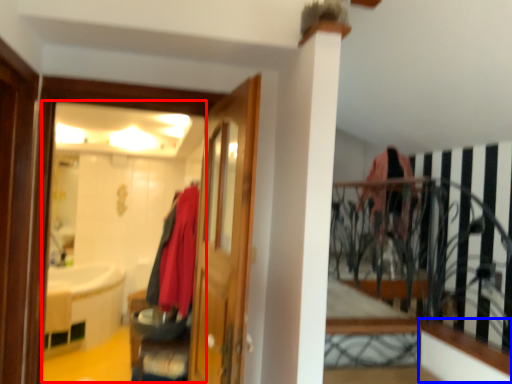
Question: Which object is further to the camera taking this photo, mirror (highlighted by a red box) or ledge (highlighted by a blue box)?

Choices:
 (A) mirror
 (B) ledge

Answer: (B)